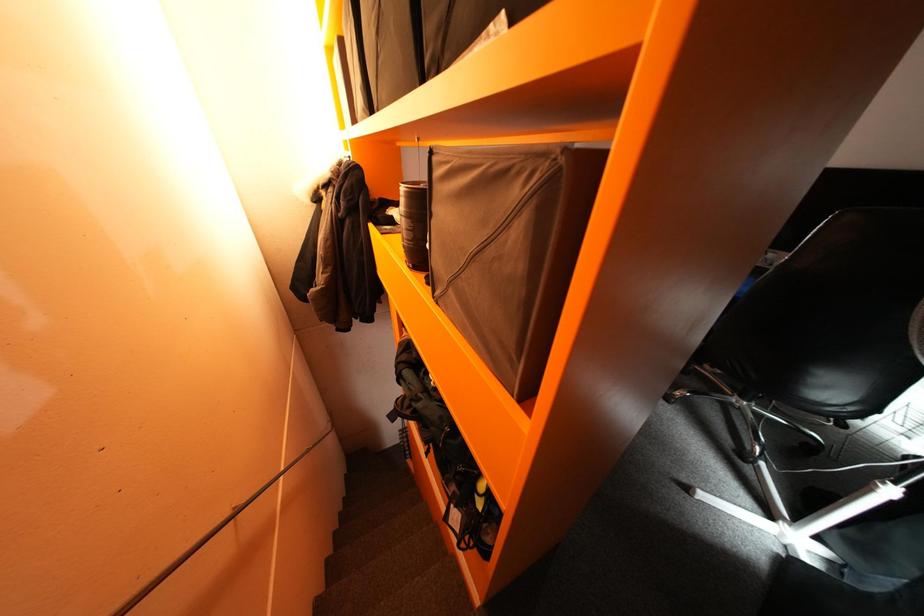
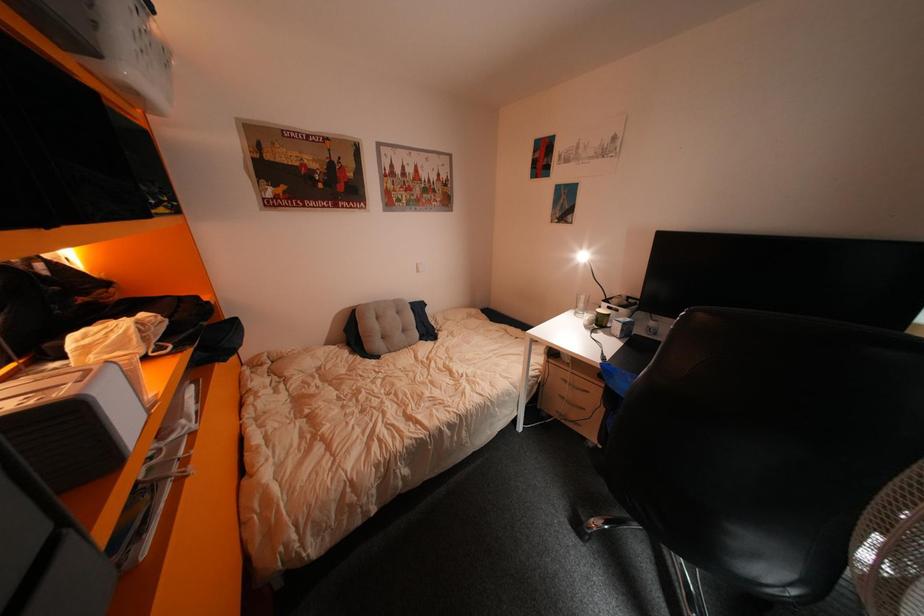
Consider the image. Which direction would the cameraman need to move to produce the second image?

The cameraman walked toward right, forward.